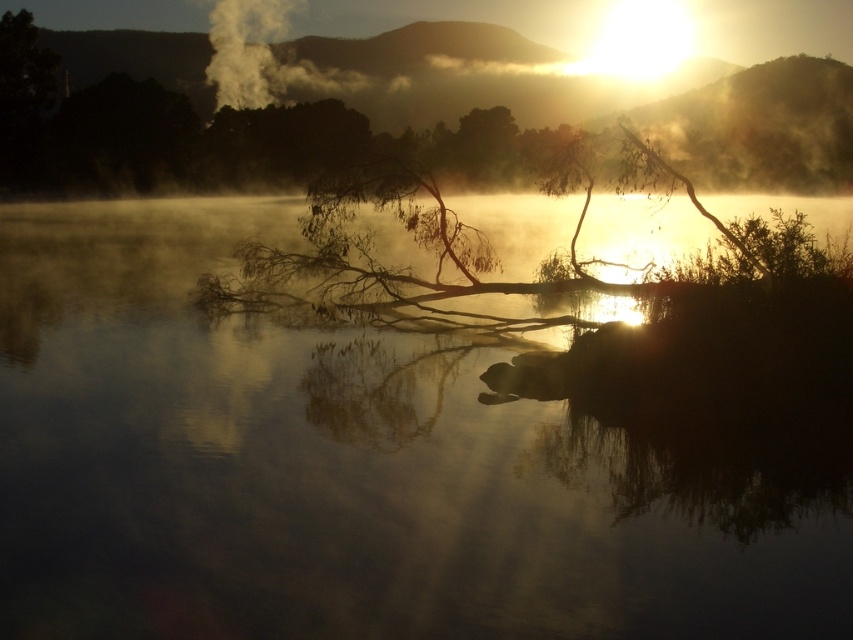
You are a photographer trying to capture the reflection of the sun in the transparent water at center. Based on the scene description, where should you aim your camera to ensure the reflection is centered in your shot?

The transparent water at center is located at point (354, 467), so you should aim your camera at that coordinate to center the reflection.

You are a photographer trying to capture the reflection of the transparent water at center in your shot. Since the white smoke at upper center might block the view, can you determine which object is closer to the camera to ensure proper focus?

The transparent water at center is taller than the white smoke at upper center, meaning it is closer to the camera. Focus on the transparent water at center to capture its reflection properly.